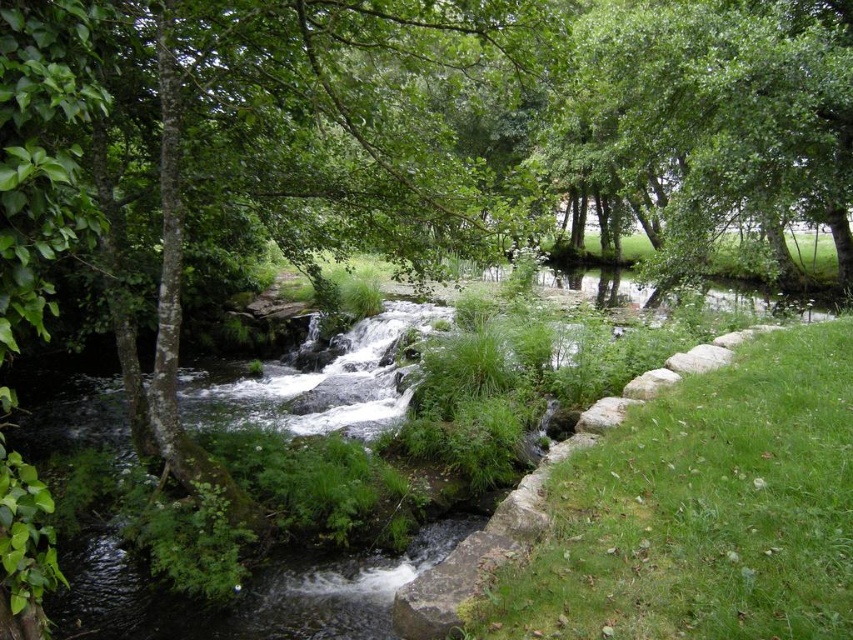
Question: Can you confirm if green grass at lower right is thinner than green leafy tree at upper center?

Choices:
 (A) no
 (B) yes

Answer: (B)

Question: Is green grass at lower right further to camera compared to green leafy tree at upper center?

Choices:
 (A) yes
 (B) no

Answer: (B)

Question: Which of the following is the farthest from the observer?

Choices:
 (A) click(x=761, y=436)
 (B) click(x=786, y=220)

Answer: (B)

Question: Observing the image, what is the correct spatial positioning of green grass at lower right in reference to green leafy tree at upper center?

Choices:
 (A) right
 (B) left

Answer: (B)